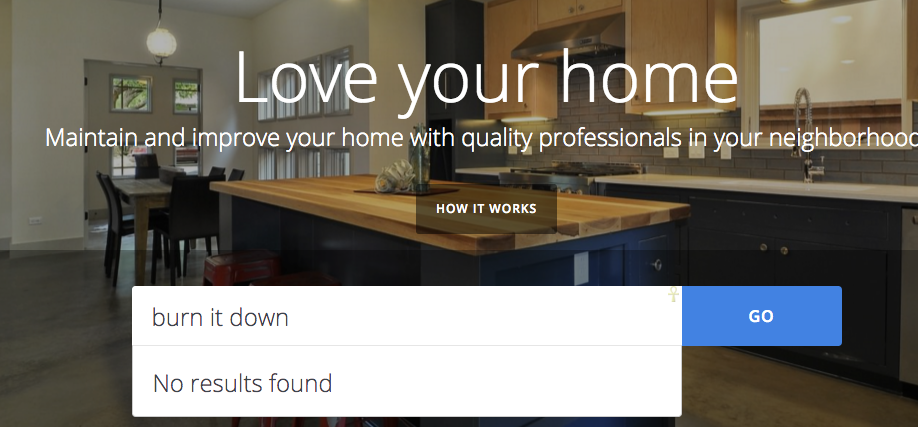
Where is `windows`? windows is located at coordinates (137, 99), (184, 98), (126, 166), (187, 162).